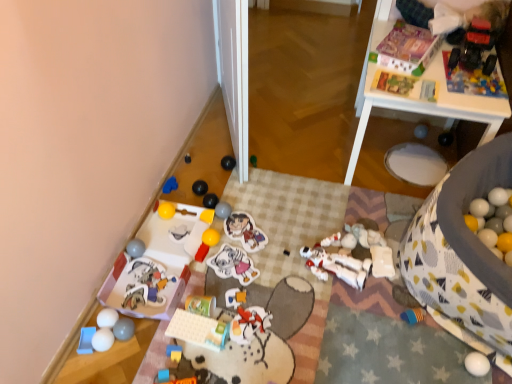
You are a GUI agent. You are given a task and a screenshot of the screen. Output one action in this format:
    pyautogui.click(x=<x>, y=<y>)
    Task: Click on the vacant space behind rubber yellow block at lower center, marked as the eleventh toy in a left-to-right arrangement
    The height and width of the screenshot is (384, 512).
    Given the screenshot: What is the action you would take?
    [188, 312]